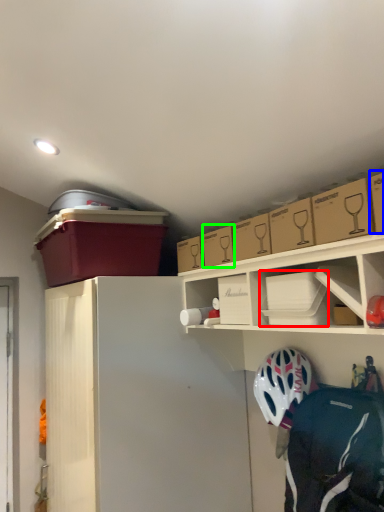
Question: Which object is positioned farthest from box (highlighted by a red box)? Select from box (highlighted by a blue box) and box (highlighted by a green box).

Choices:
 (A) box
 (B) box

Answer: (A)